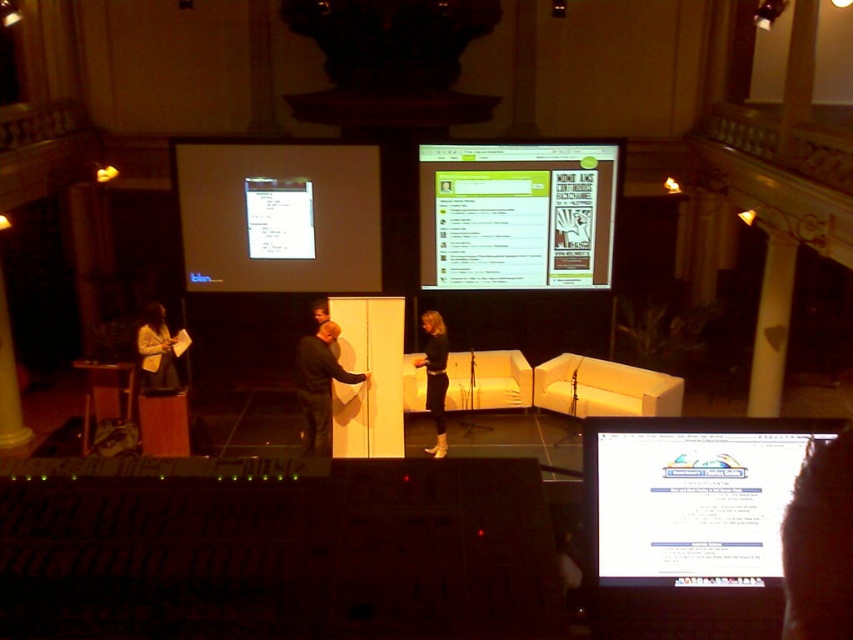
Which is more to the right, dark gray fabric jacket at center or light beige sweater at lower left?

dark gray fabric jacket at center

Looking at this image, is the position of dark gray fabric jacket at center more distant than that of light beige sweater at lower left?

No.

Is point (310, 426) farther from viewer compared to point (148, 330)?

That is False.

Where is `dark gray fabric jacket at center`? The image size is (853, 640). dark gray fabric jacket at center is located at coordinates (318, 385).

Is white glossy computer screen at center positioned in front of light beige sweater at lower left?

Yes, it is in front of light beige sweater at lower left.

Who is taller, white glossy computer screen at center or light beige sweater at lower left?

Standing taller between the two is light beige sweater at lower left.

Does point (808, 428) lie behind point (144, 308)?

No, (808, 428) is in front of (144, 308).

Locate an element on the screen. white glossy computer screen at center is located at coordinates (691, 497).

Which is more to the left, white glossy computer screen at center or black leather pants at center?

black leather pants at center

Can you confirm if white glossy computer screen at center is positioned to the right of black leather pants at center?

Yes, white glossy computer screen at center is to the right of black leather pants at center.

Is point (750, 448) positioned in front of point (436, 362)?

Yes.

Where is `white glossy computer screen at center`? white glossy computer screen at center is located at coordinates (691, 497).